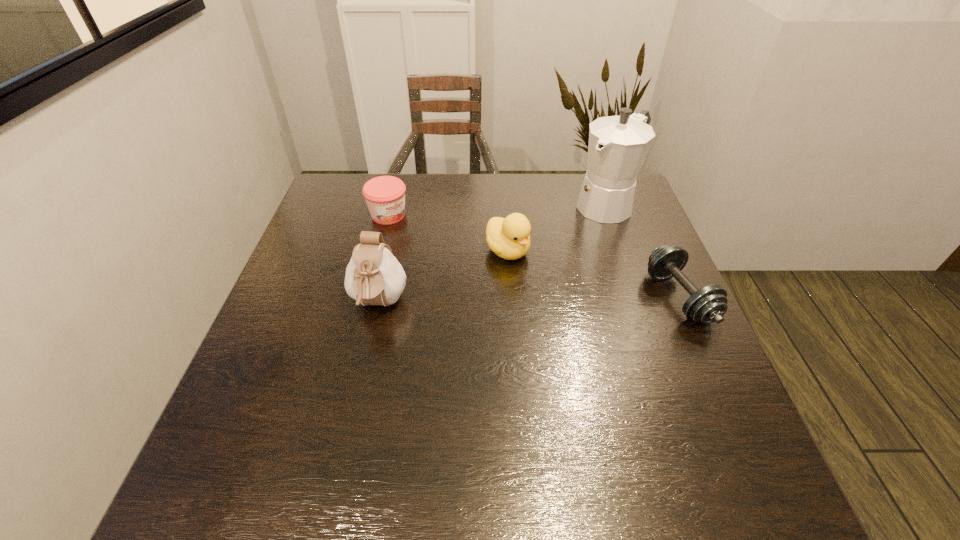
In order to click on free space that satisfies the following two spatial constraints: 1. on the front side of the tallest object; 2. on the right side of the dumbbell in this screenshot , I will do `click(642, 298)`.

Find the location of a particular element. vacant point that satisfies the following two spatial constraints: 1. on the front side of the third object from right to left; 2. on the left side of the dumbbell is located at coordinates (511, 298).